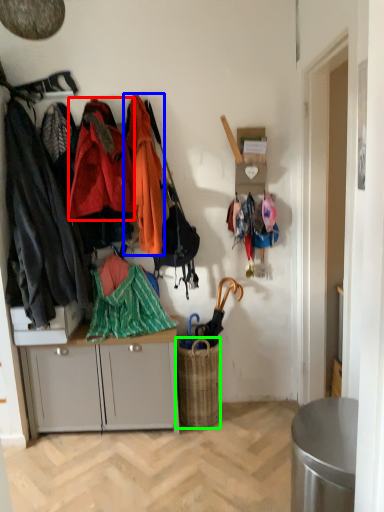
Question: Estimate the real-world distances between objects in this image. Which object is closer to clothing (highlighted by a red box), clothing (highlighted by a blue box) or picnic basket (highlighted by a green box)?

Choices:
 (A) clothing
 (B) picnic basket

Answer: (A)